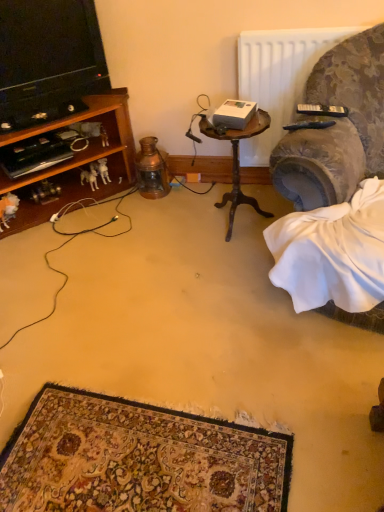
I want to click on empty space that is in between white plastic dog at lower left and white fabric at lower right, so click(x=184, y=241).